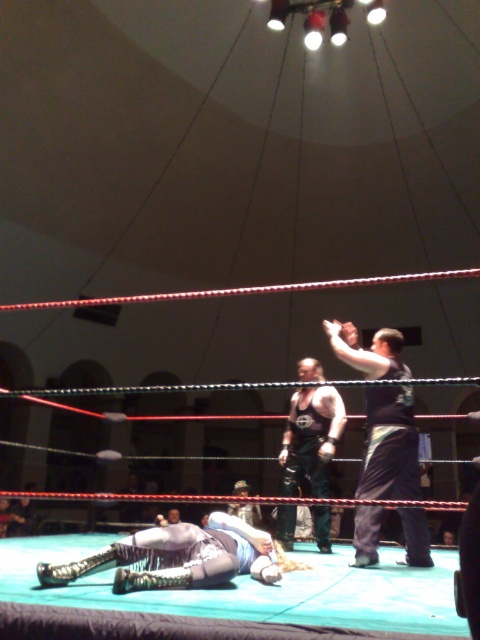
Question: In this image, where is dark blue fabric shirt at upper right located relative to black leather boots at center?

Choices:
 (A) right
 (B) left

Answer: (A)

Question: Among these points, which one is nearest to the camera?

Choices:
 (A) (313, 467)
 (B) (411, 564)

Answer: (B)

Question: Does dark blue fabric shirt at upper right have a larger size compared to black leather boots at center?

Choices:
 (A) yes
 (B) no

Answer: (A)

Question: Can you confirm if dark blue fabric shirt at upper right is positioned below black leather boots at center?

Choices:
 (A) yes
 (B) no

Answer: (B)

Question: Which object appears closest to the camera in this image?

Choices:
 (A) black leather boots at center
 (B) dark blue fabric shirt at upper right

Answer: (B)